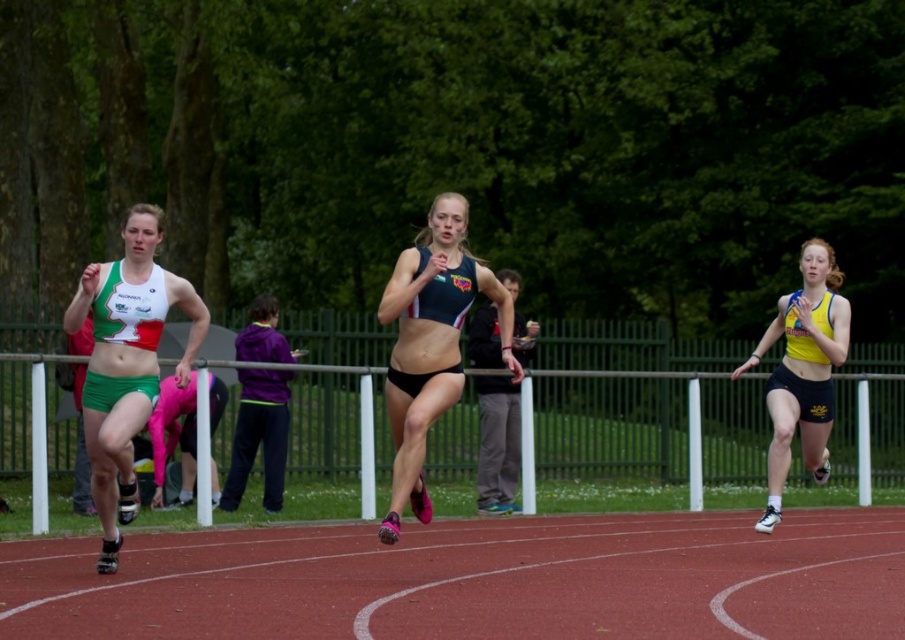
Question: Which point is closer to the camera?

Choices:
 (A) yellow matte tank top at right
 (B) purple fleece jacket at center

Answer: (A)

Question: Does matte green shorts at left appear under black matte shorts at center?

Choices:
 (A) yes
 (B) no

Answer: (B)

Question: Can you confirm if yellow matte tank top at right is smaller than purple fleece jacket at center?

Choices:
 (A) yes
 (B) no

Answer: (A)

Question: Is rubberized red track at center below white plastic rail at center?

Choices:
 (A) no
 (B) yes

Answer: (B)

Question: Among these objects, which one is nearest to the camera?

Choices:
 (A) white plastic rail at center
 (B) purple fleece jacket at center

Answer: (A)

Question: Which object appears closest to the camera in this image?

Choices:
 (A) purple fleece jacket at center
 (B) matte green shorts at left
 (C) yellow matte tank top at right
 (D) rubberized red track at center

Answer: (D)